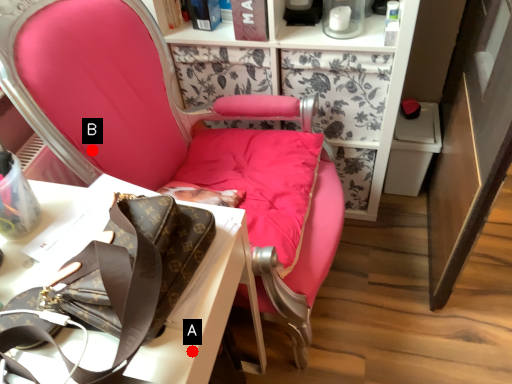
Question: Two points are circled on the image, labeled by A and B beside each circle. Which point is closer to the camera taking this photo?

Choices:
 (A) A is closer
 (B) B is closer

Answer: (A)